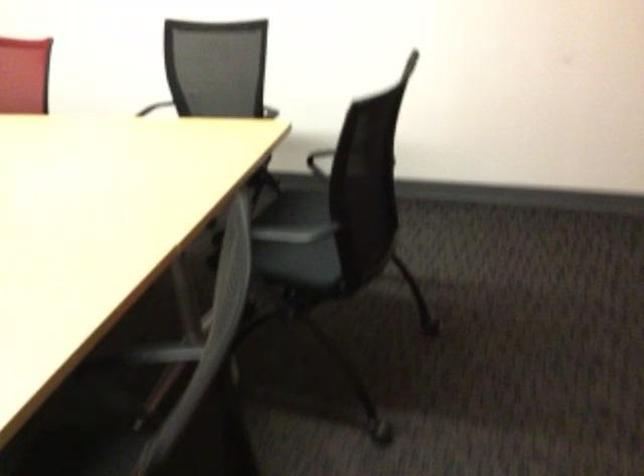
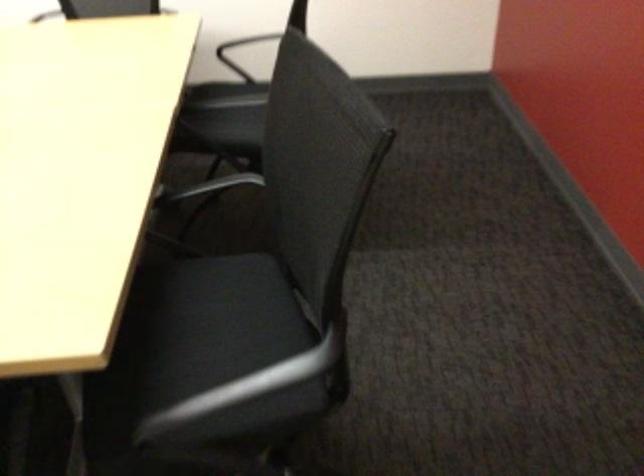
In the second image, find the point that corresponds to (x=305, y=204) in the first image.

(223, 93)